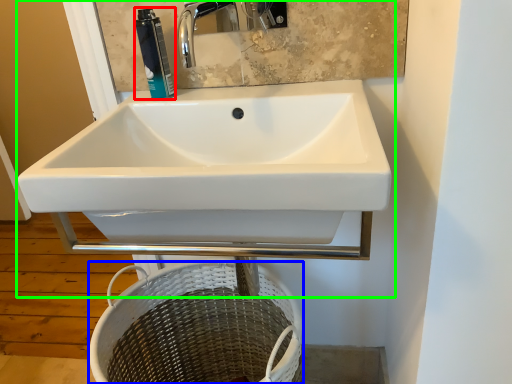
Question: Which is nearer to the toiletry (highlighted by a red box)? basket (highlighted by a blue box) or sink (highlighted by a green box).

Choices:
 (A) basket
 (B) sink

Answer: (B)